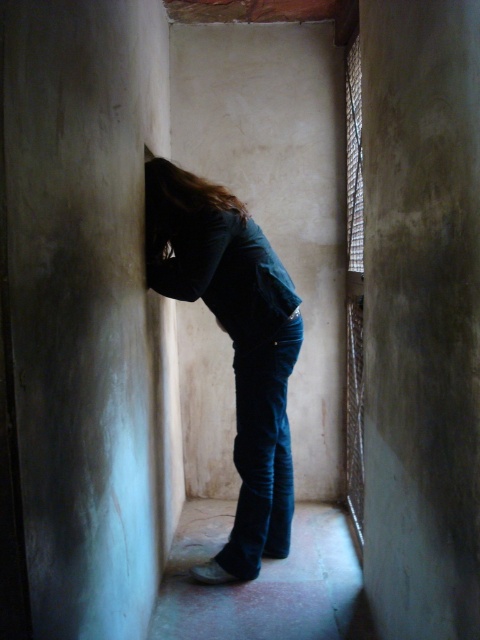
Between dark blue jeans at center and brown smooth hair at center, which one has more height?

Standing taller between the two is dark blue jeans at center.

Does dark blue jeans at center lie behind brown smooth hair at center?

No, it is not.

What do you see at coordinates (233, 344) in the screenshot? I see `dark blue jeans at center` at bounding box center [233, 344].

Where is `dark blue jeans at center`? dark blue jeans at center is located at coordinates (233, 344).